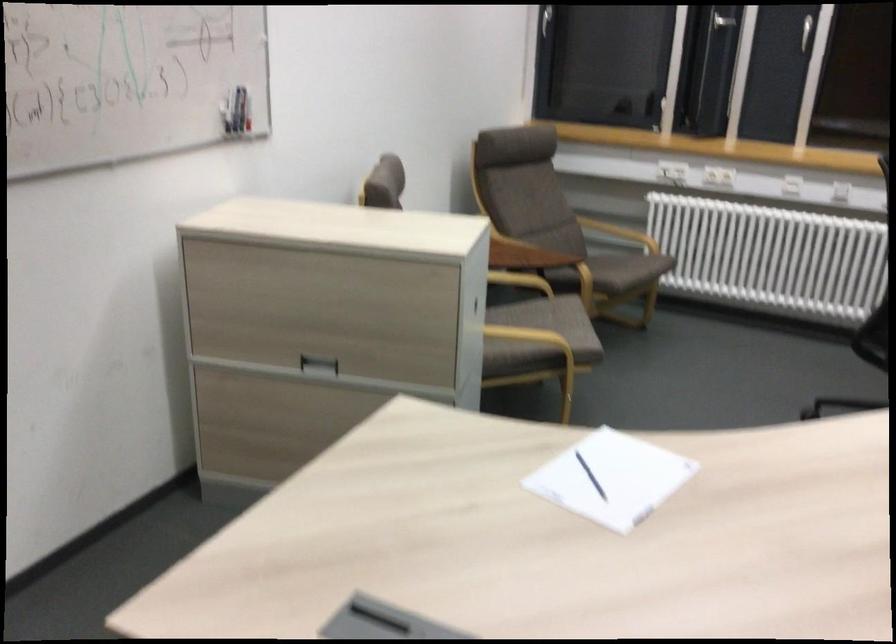
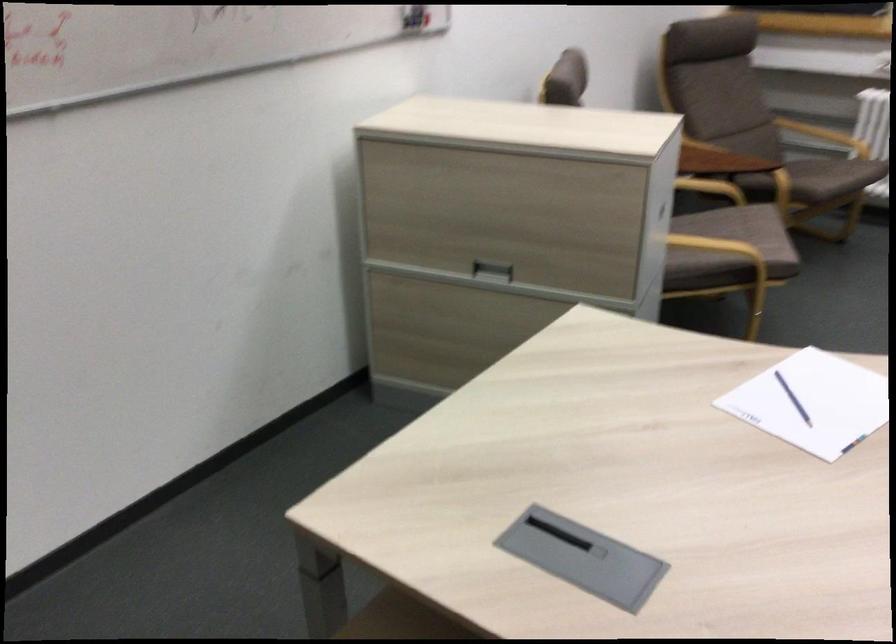
Locate, in the second image, the point that corresponds to point (627, 269) in the first image.

(831, 176)